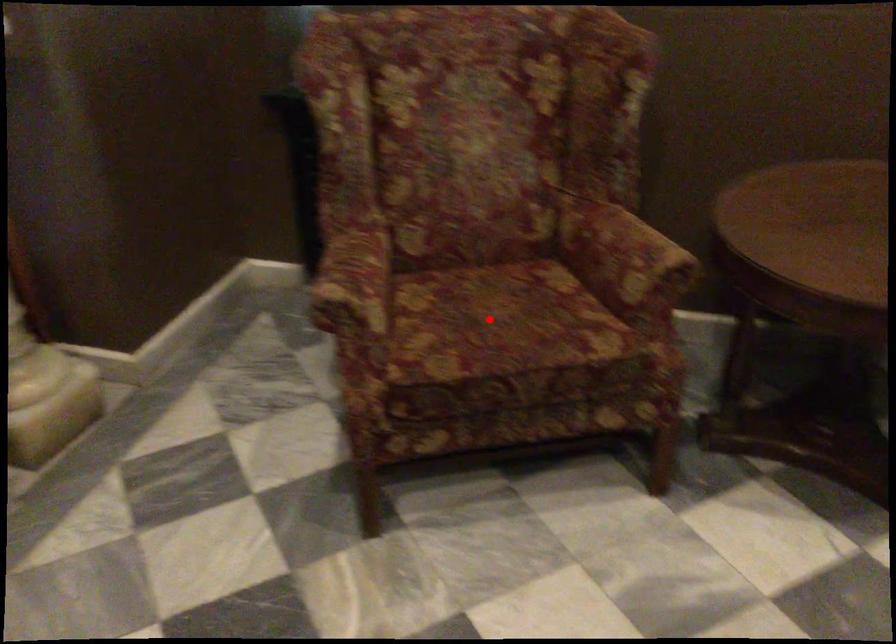
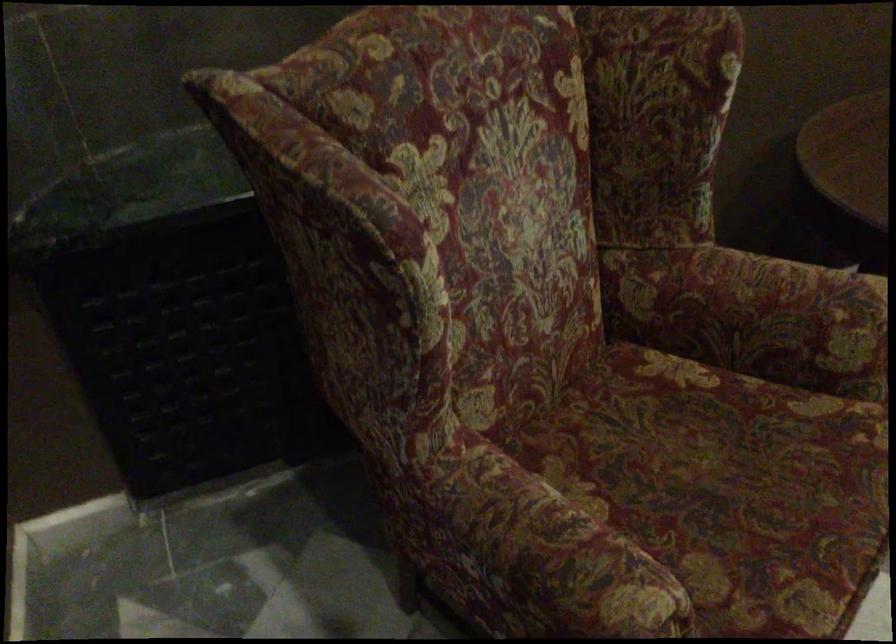
Where in the second image is the point corresponding to the highlighted location from the first image?

(726, 486)